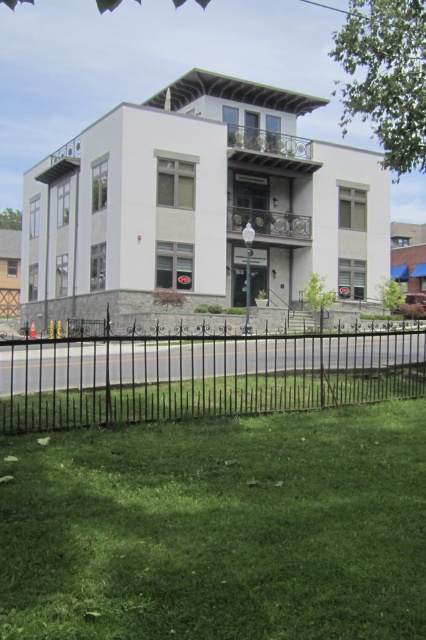
Question: Is green grass at lower center to the right of black wrought iron fence at lower center from the viewer's perspective?

Choices:
 (A) no
 (B) yes

Answer: (B)

Question: Which point is farther from the camera taking this photo?

Choices:
 (A) (290, 352)
 (B) (290, 504)

Answer: (A)

Question: Is green grass at lower center below black wrought iron fence at lower center?

Choices:
 (A) yes
 (B) no

Answer: (A)

Question: Does green grass at lower center have a lesser width compared to black wrought iron fence at lower center?

Choices:
 (A) no
 (B) yes

Answer: (B)

Question: Which of the following is the closest to the observer?

Choices:
 (A) (242, 573)
 (B) (83, 342)

Answer: (A)